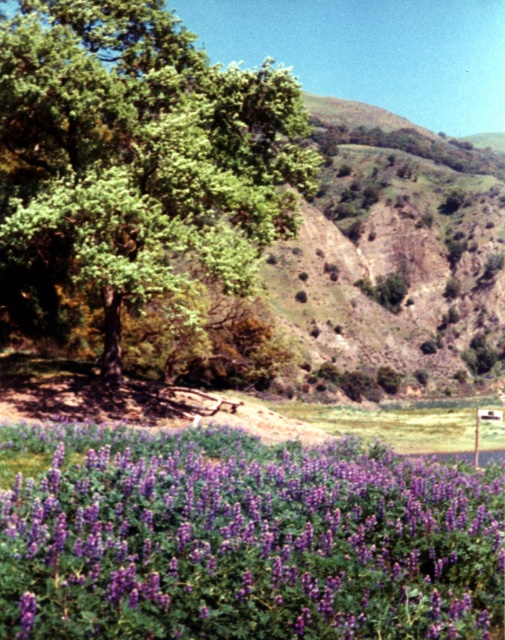
Is purple soft-textured flowers at lower center wider than green leafy tree at upper left?

No.

Identify the location of purple soft-textured flowers at lower center. The image size is (505, 640). (244, 540).

Can you confirm if purple soft-textured flowers at lower center is positioned to the left of white plastic street sign at lower right?

Yes, purple soft-textured flowers at lower center is to the left of white plastic street sign at lower right.

Is purple soft-textured flowers at lower center to the right of white plastic street sign at lower right from the viewer's perspective?

In fact, purple soft-textured flowers at lower center is to the left of white plastic street sign at lower right.

What do you see at coordinates (244, 540) in the screenshot?
I see `purple soft-textured flowers at lower center` at bounding box center [244, 540].

Where is `purple soft-textured flowers at lower center`? purple soft-textured flowers at lower center is located at coordinates (244, 540).

Is the position of green leafy tree at upper left less distant than that of white plastic street sign at lower right?

No, green leafy tree at upper left is behind white plastic street sign at lower right.

Does green leafy tree at upper left appear under white plastic street sign at lower right?

No.

Which is in front, point (119, 92) or point (501, 412)?

Point (119, 92)

The height and width of the screenshot is (640, 505). In order to click on green leafy tree at upper left in this screenshot , I will do `click(135, 161)`.